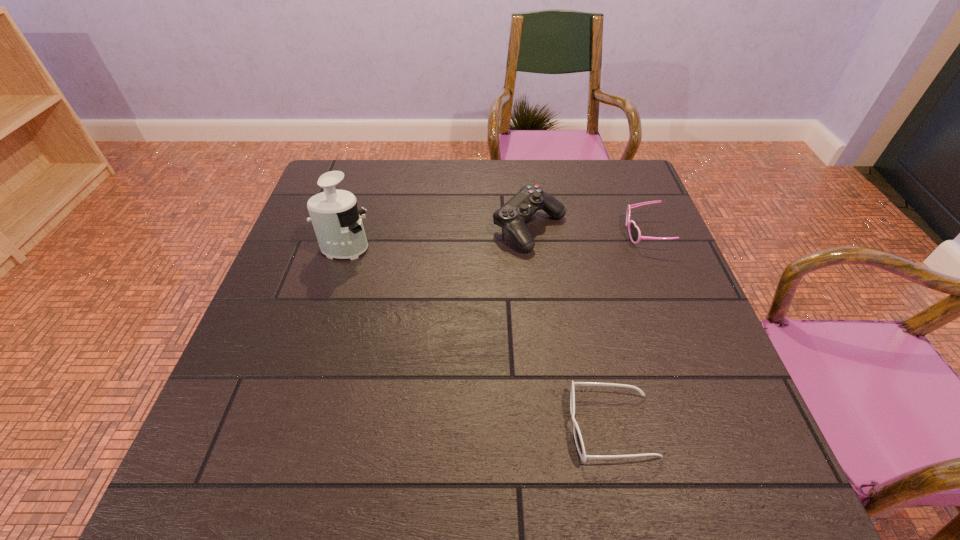
At what (x,y) coordinates should I click in order to perform the action: click on vacant area that lies between the control and the leftmost object. Please return your answer as a coordinate pair (x, y). This screenshot has height=540, width=960. Looking at the image, I should click on [437, 239].

Find the location of a particular element. unoccupied position between the control and the tallest object is located at coordinates (437, 239).

The height and width of the screenshot is (540, 960). Find the location of `vacant point located between the shortest object and the control`. vacant point located between the shortest object and the control is located at coordinates (570, 327).

Identify the location of empty location between the second tallest object and the shorter sunglasses. The height and width of the screenshot is (540, 960). click(570, 327).

Locate which object is the second closest to the juicer. Please provide its 2D coordinates. Your answer should be formatted as a tuple, i.e. [(x, y)], where the tuple contains the x and y coordinates of a point satisfying the conditions above.

[(577, 434)]

Identify which object is located as the nearest to the tallest object. Please provide its 2D coordinates. Your answer should be formatted as a tuple, i.e. [(x, y)], where the tuple contains the x and y coordinates of a point satisfying the conditions above.

[(512, 216)]